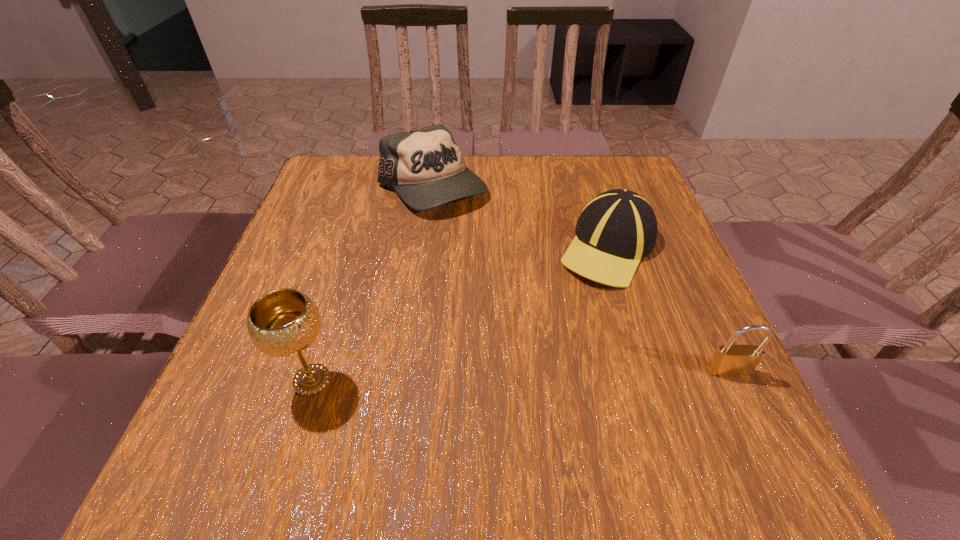
The height and width of the screenshot is (540, 960). Identify the location of free space on the desktop that is between the chalice and the padlock and is positioned with the brim of the right baseball cap facing forward. (471, 376).

Where is `free space on the desktop that is between the tallest object and the padlock and is positioned on the front-facing side of the left baseball cap`? This screenshot has height=540, width=960. free space on the desktop that is between the tallest object and the padlock and is positioned on the front-facing side of the left baseball cap is located at coordinates (539, 375).